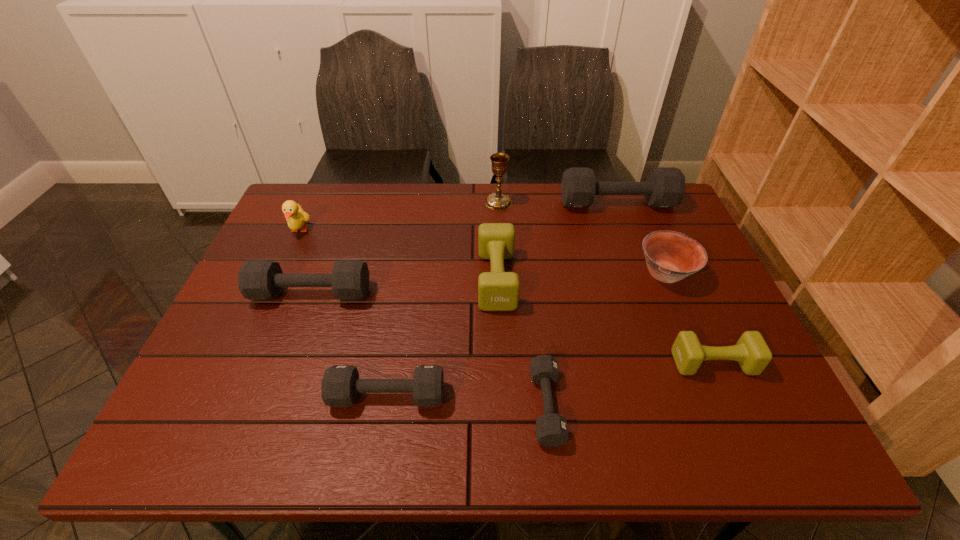
Where is `object at the far left corner`? The image size is (960, 540). object at the far left corner is located at coordinates (295, 216).

This screenshot has width=960, height=540. In order to click on object that is at the far right corner in this screenshot , I will do `click(665, 186)`.

Where is `vacant space at the far edge`? vacant space at the far edge is located at coordinates (387, 184).

The width and height of the screenshot is (960, 540). I want to click on vacant space at the near edge of the desktop, so click(x=346, y=420).

In the image, there is a desktop. Identify the location of free space at the left edge. (201, 390).

The image size is (960, 540). I want to click on vacant position at the near left corner of the desktop, so click(200, 434).

Where is `vacant space that is in between the farther olive dumbbell and the third farthest object`? vacant space that is in between the farther olive dumbbell and the third farthest object is located at coordinates (398, 254).

Where is `blank region between the bowl and the smallest gray dumbbell`? blank region between the bowl and the smallest gray dumbbell is located at coordinates click(x=606, y=340).

At what (x,y) coordinates should I click in order to perform the action: click on vacant space in between the second farthest gray dumbbell and the right olive dumbbell. Please return your answer as a coordinate pair (x, y). The width and height of the screenshot is (960, 540). Looking at the image, I should click on [513, 328].

The height and width of the screenshot is (540, 960). In order to click on empty space that is in between the duckling and the second smallest gray dumbbell in this screenshot , I will do `click(344, 313)`.